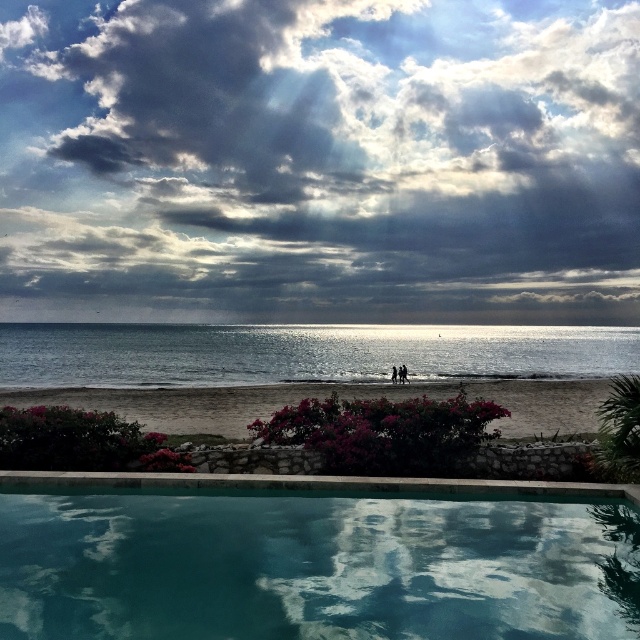
Question: Which of these objects is positioned farthest from the teal glass swimming pool at bottom?

Choices:
 (A) shiny silver water at center
 (B) beige sand beach at lower center
 (C) cloudy sky at upper center

Answer: (C)

Question: Considering the real-world distances, which object is closest to the beige sand beach at lower center?

Choices:
 (A) shiny silver water at center
 (B) cloudy sky at upper center

Answer: (A)

Question: Can you confirm if cloudy sky at upper center is positioned below beige sand beach at lower center?

Choices:
 (A) yes
 (B) no

Answer: (B)

Question: Which object is closer to the camera taking this photo?

Choices:
 (A) shiny silver water at center
 (B) cloudy sky at upper center
 (C) teal glass swimming pool at bottom
 (D) beige sand beach at lower center

Answer: (C)

Question: Does cloudy sky at upper center have a smaller size compared to teal glass swimming pool at bottom?

Choices:
 (A) yes
 (B) no

Answer: (B)

Question: Does cloudy sky at upper center lie in front of shiny silver water at center?

Choices:
 (A) yes
 (B) no

Answer: (B)